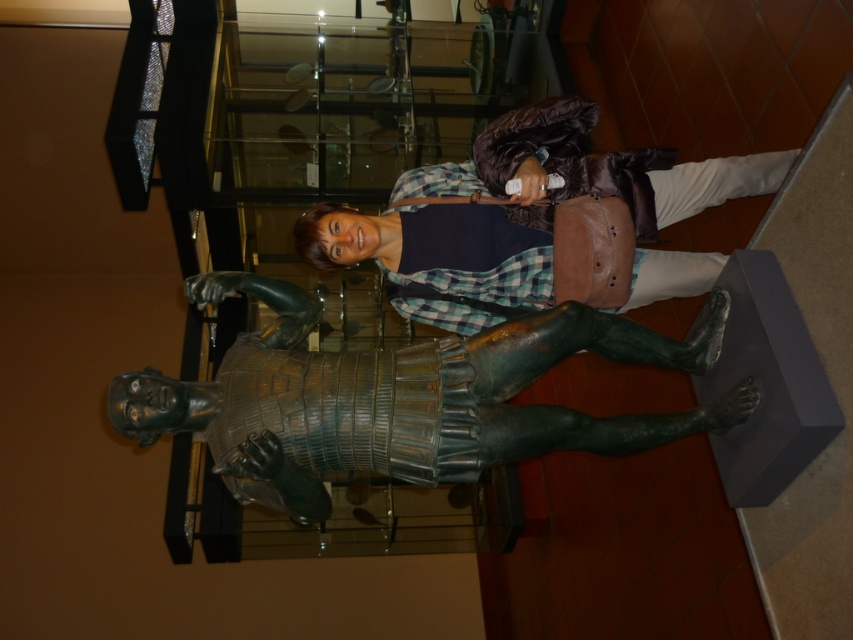
You are an art conservator tasked with moving the green patinated bronze statue at center and the matte brown leather bag at center to a storage room. The storage room has a narrow doorway that only allows items up to the width of the bronze statue to pass through. Which item can you move through the doorway without needing to adjust its orientation?

The green patinated bronze statue at center has a lesser width compared to the matte brown leather bag at center, so the statue can pass through the doorway without adjustment, while the bag may need to be reoriented or cannot fit.

You are a security guard in the museum. You notice the green patinated bronze statue at center and the matte brown leather bag at center. Which object is closer to you?

The green patinated bronze statue at center is closer to the viewer than the matte brown leather bag at center.